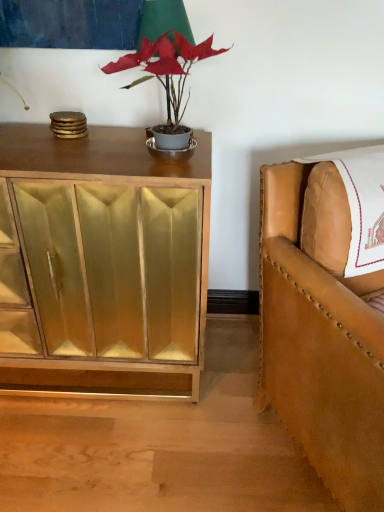
Question: From the image's perspective, relative to tan leather chair at right, is matte gray pot at center above or below?

Choices:
 (A) below
 (B) above

Answer: (B)

Question: Based on their sizes in the image, would you say matte gray pot at center is bigger or smaller than tan leather chair at right?

Choices:
 (A) small
 (B) big

Answer: (A)

Question: Which is farther from the green fabric table lamp at upper center?

Choices:
 (A) tan leather chair at right
 (B) gold mirrored cabinet at left
 (C) matte gray pot at center

Answer: (A)

Question: Which is farther from the matte gray pot at center?

Choices:
 (A) green fabric table lamp at upper center
 (B) tan leather chair at right
 (C) gold mirrored cabinet at left

Answer: (B)